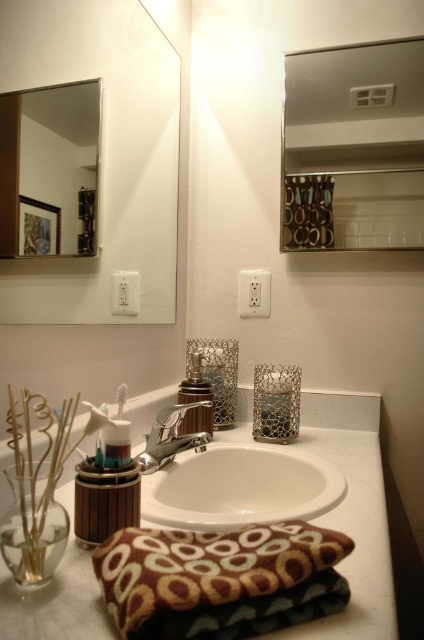
Question: Which object is the closest to the brown textured pillow at lower center?

Choices:
 (A) wooden toothbrush holder at lower left
 (B) matte silver mirror at upper left

Answer: (A)

Question: Which of the following is the closest to the observer?

Choices:
 (A) (323, 205)
 (B) (208, 394)

Answer: (B)

Question: Can you confirm if white matte counter top at center is positioned to the right of satin gold faucet at center?

Choices:
 (A) no
 (B) yes

Answer: (B)

Question: Which point is farther to the camera?

Choices:
 (A) polished chrome faucet at center
 (B) matte silver mirror at upper left
 (C) clear glass mirror at upper left
 (D) satin gold faucet at center

Answer: (D)

Question: Can you confirm if clear glass mirror at upper left is wider than white ceramic sink at center?

Choices:
 (A) yes
 (B) no

Answer: (B)

Question: Can you confirm if brown textured pillow at lower center is positioned below satin gold faucet at center?

Choices:
 (A) no
 (B) yes

Answer: (B)